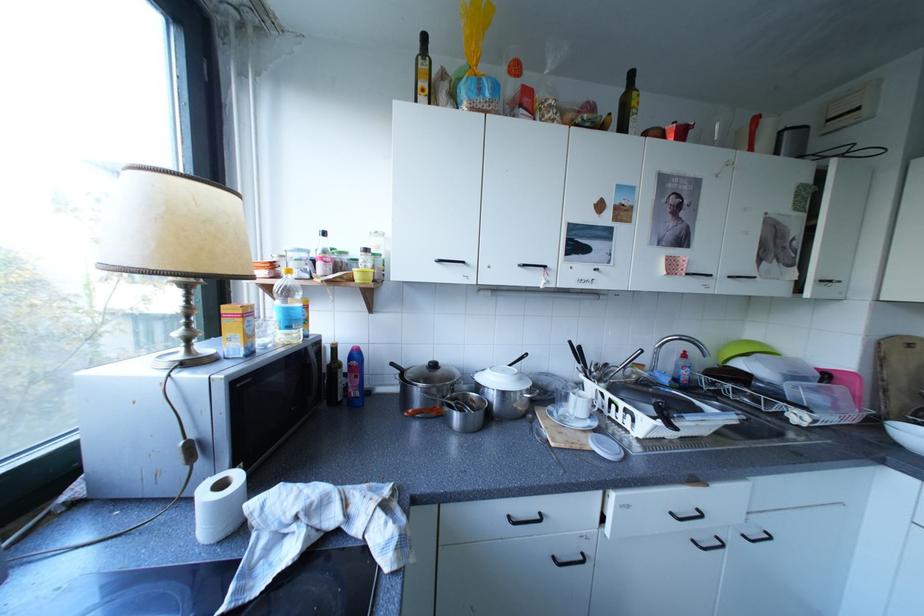
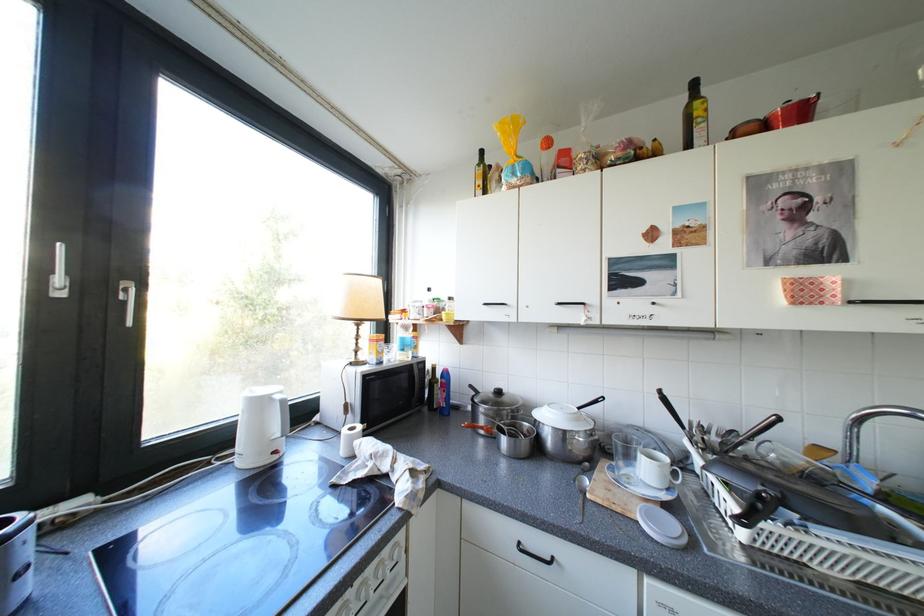
Question: The first image is from the beginning of the video and the second image is from the end. How did the camera likely rotate when shooting the video?

Choices:
 (A) Left
 (B) Right
 (C) Up
 (D) Down

Answer: (A)